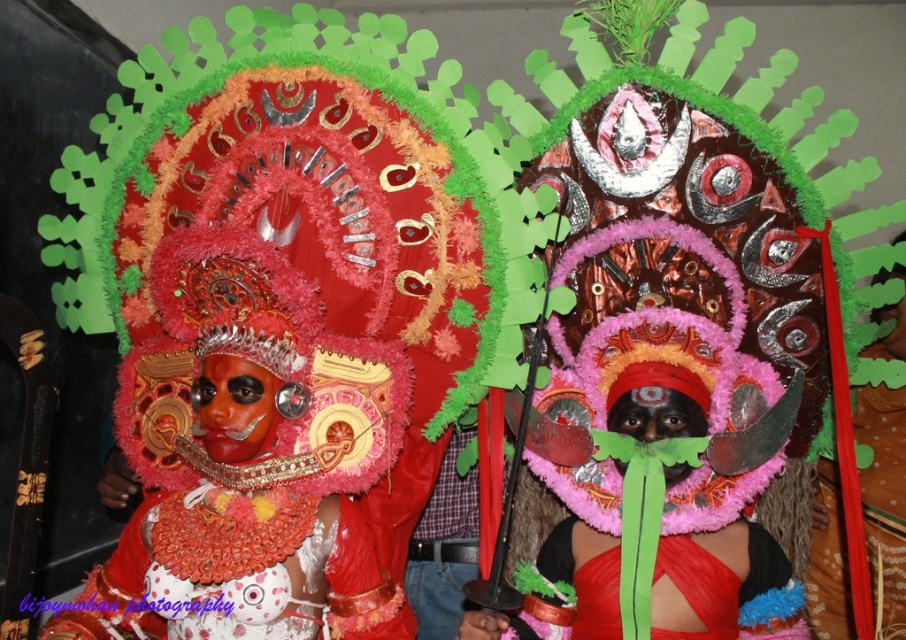
You are a photographer standing at the front of the scene. You want to take a closeup photo of the green feather headdress at center without moving your position. Can you do it with a standard camera lens that has a minimum focusing distance of 1.5 meters?

The green feather headdress at center is 1.68 meters away from viewer. Since the minimum focusing distance is 1.5 meters, the photographer cannot take a closeup photo without moving closer.

You are a photographer at the festival and want to capture both the matte red mask at center and the green feather headdress at center in a single frame. Since your camera has a limited field of view, you need to know which object is wider. Which one is wider?

The matte red mask at center is wider than the green feather headdress at center according to the description.

You are an artist trying to replicate the costumes from the image. You need to decide which object to paint first based on their sizes. Which one should you start with, the matte red mask at center or the shiny red fabric at center?

The matte red mask at center has a larger size compared to the shiny red fabric at center, so you should start with the matte red mask at center first.